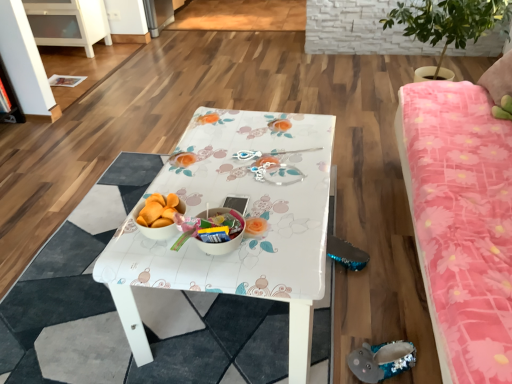
Question: Is sequined gray slipper at lower right taller or shorter than pink floral fabric studio couch at right?

Choices:
 (A) short
 (B) tall

Answer: (A)

Question: In the image, is sequined gray slipper at lower right on the left side or the right side of pink floral fabric studio couch at right?

Choices:
 (A) right
 (B) left

Answer: (B)

Question: Which of these objects is positioned farthest from the sequined gray slipper at lower right?

Choices:
 (A) green leafy plant at upper right
 (B) white glossy cabinet at upper left
 (C) white glossy bowl at center
 (D) pink floral fabric studio couch at right
 (E) white glossy table at center

Answer: (B)

Question: Which is farther from the white glossy table at center?

Choices:
 (A) pink floral fabric studio couch at right
 (B) white glossy bowl at center
 (C) white glossy cabinet at upper left
 (D) green leafy plant at upper right
 (E) sequined gray slipper at lower right

Answer: (C)